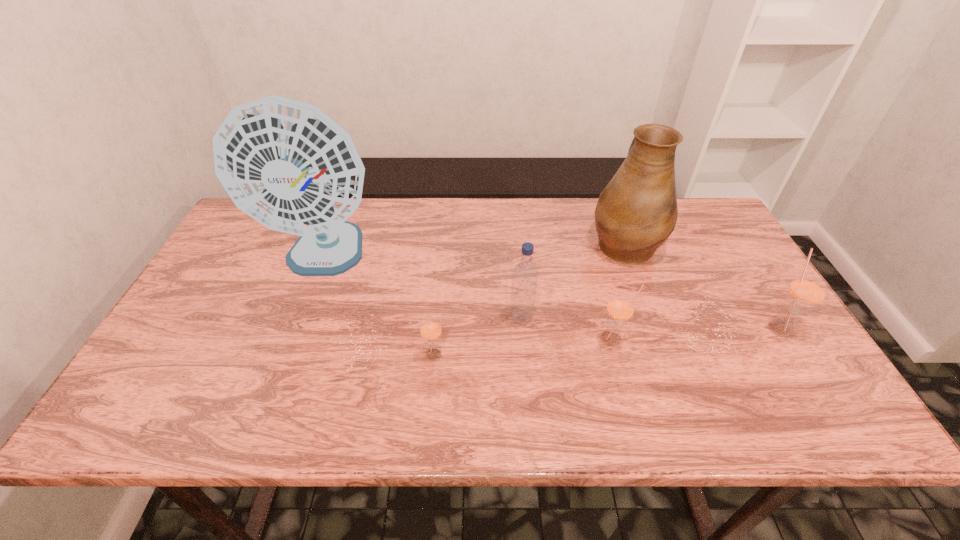
At what (x,y) coordinates should I click in order to perform the action: click on vacant area that lies between the leftmost object and the shortest straw. Please return your answer as a coordinate pair (x, y). This screenshot has height=540, width=960. Looking at the image, I should click on (380, 307).

Find the location of `empty space that is in between the second straw from left to right and the water bottle`. empty space that is in between the second straw from left to right and the water bottle is located at coordinates (566, 330).

Where is `vacant area that lies between the fifth tallest object and the leftmost object`? This screenshot has height=540, width=960. vacant area that lies between the fifth tallest object and the leftmost object is located at coordinates (468, 300).

The height and width of the screenshot is (540, 960). Identify the location of free spot between the pitcher and the rightmost straw. (702, 285).

Locate an element on the screen. empty space that is in between the second shortest straw and the fan is located at coordinates (468, 300).

Identify the location of vacant area that lies between the rightmost straw and the fan. (552, 293).

Identify the location of the fourth closest object to the pitcher. (430, 328).

At what (x,y) coordinates should I click in order to perform the action: click on object that is the second nearest to the water bottle. Please return your answer as a coordinate pair (x, y). The width and height of the screenshot is (960, 540). Looking at the image, I should click on (430, 328).

Where is `straw object that ranks as the closest to the fifth shortest object`? The image size is (960, 540). straw object that ranks as the closest to the fifth shortest object is located at coordinates (620, 308).

Identify which straw is the nearest to the rightmost straw. Please provide its 2D coordinates. Your answer should be formatted as a tuple, i.e. [(x, y)], where the tuple contains the x and y coordinates of a point satisfying the conditions above.

[(620, 308)]